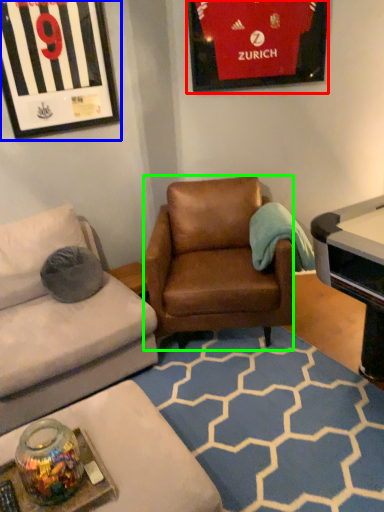
Question: Which is farther away from picture frame (highlighted by a red box)? picture frame (highlighted by a blue box) or chair (highlighted by a green box)?

Choices:
 (A) picture frame
 (B) chair

Answer: (B)